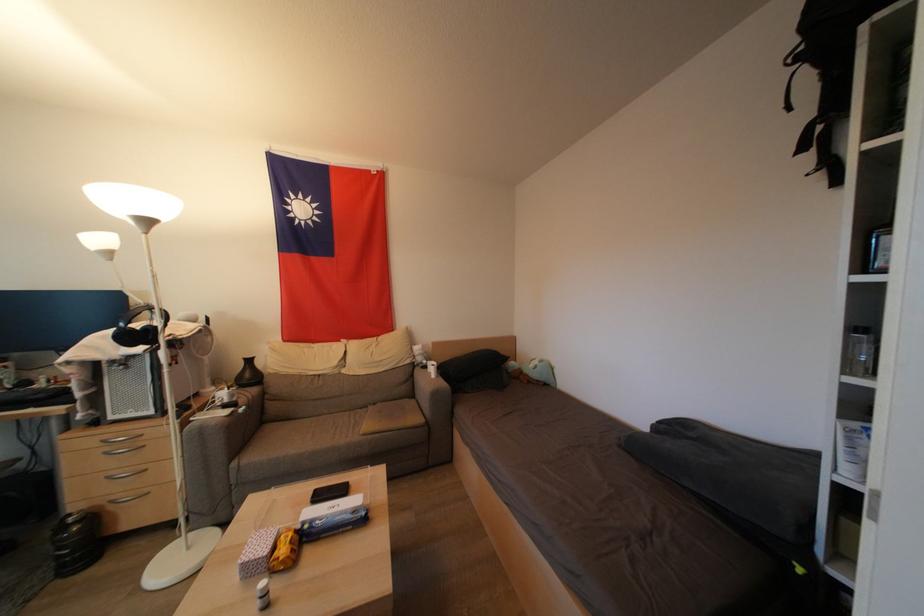
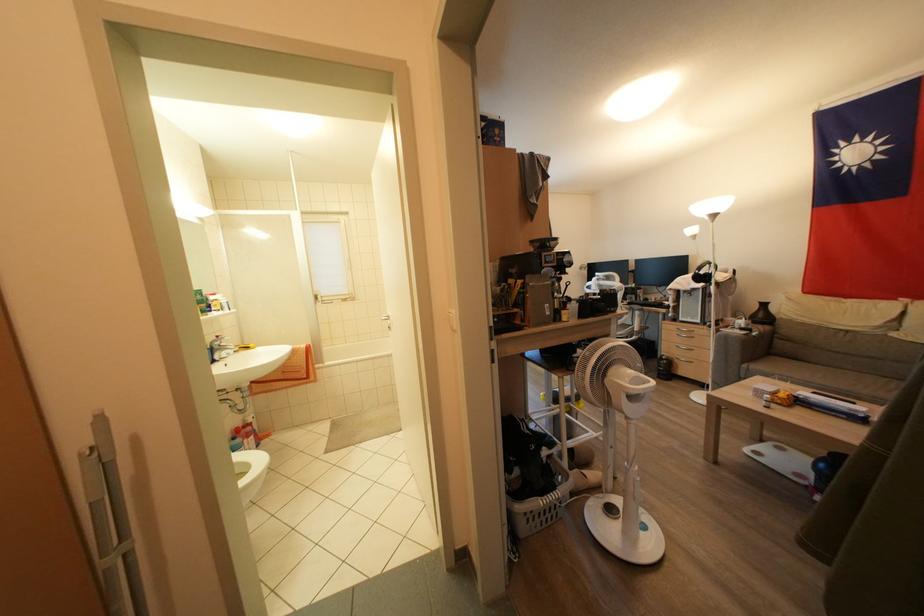
Find the pixel in the second image that matches (x=229, y=410) in the first image.

(747, 333)